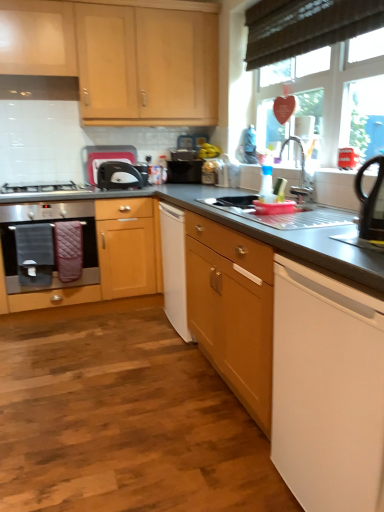
The height and width of the screenshot is (512, 384). Describe the element at coordinates (369, 210) in the screenshot. I see `black plastic kettle at right, marked as the second appliance in a top-to-bottom arrangement` at that location.

Consider the image. What is the approximate width of metallic stainless steel sink at center?

21.48 inches.

Where is `metallic stainless steel sink at center`? The image size is (384, 512). metallic stainless steel sink at center is located at coordinates (281, 214).

At what (x,y) coordinates should I click in order to perform the action: click on black plastic kettle at right, marked as the second appliance in a top-to-bottom arrangement. Please return your answer as a coordinate pair (x, y). Image resolution: width=384 pixels, height=512 pixels. Looking at the image, I should click on (369, 210).

Is matte wood cabinets at upper left, arranged as the second cabinetry when ordered from the bottom, wider or thinner than black matte microwave at center?

Considering their sizes, matte wood cabinets at upper left, arranged as the second cabinetry when ordered from the bottom, looks broader than black matte microwave at center.

From the image's perspective, is matte wood cabinets at upper left, arranged as the second cabinetry when ordered from the bottom, below black matte microwave at center?

No, from the image's perspective, matte wood cabinets at upper left, arranged as the second cabinetry when ordered from the bottom, is not below black matte microwave at center.

From a real-world perspective, is matte wood cabinets at upper left, the 1th cabinetry positioned from the top, beneath black matte microwave at center?

Actually, matte wood cabinets at upper left, the 1th cabinetry positioned from the top, is physically above black matte microwave at center in the real world.

Does matte wood cabinets at upper left, arranged as the second cabinetry when ordered from the bottom, turn towards black matte microwave at center?

No, matte wood cabinets at upper left, arranged as the second cabinetry when ordered from the bottom, is not aimed at black matte microwave at center.

Is metallic stainless steel sink at center in front of or behind metallic faucet at upper right in the image?

Visually, metallic stainless steel sink at center is located in front of metallic faucet at upper right.

Is metallic stainless steel sink at center located outside metallic faucet at upper right?

Indeed, metallic stainless steel sink at center is completely outside metallic faucet at upper right.

Which point is more forward, (233, 197) or (297, 201)?

The point (297, 201) is in front.

I want to click on tap behind the metallic stainless steel sink at center, so click(x=301, y=173).

From a real-world perspective, is white matte dishwasher at lower right, the 1th home appliance in the right-to-left sequence, physically located above or below white plastic toaster at upper center, placed as the first appliance when sorted from left to right?

Clearly, from a real-world perspective, white matte dishwasher at lower right, the 1th home appliance in the right-to-left sequence, is below white plastic toaster at upper center, placed as the first appliance when sorted from left to right.

In the scene shown: Is white matte dishwasher at lower right, the 1th home appliance when ordered from front to back, in front of or behind white plastic toaster at upper center, placed as the first appliance when sorted from left to right, in the image?

Clearly, white matte dishwasher at lower right, the 1th home appliance when ordered from front to back, is in front of white plastic toaster at upper center, placed as the first appliance when sorted from left to right.

In the scene shown: Is white matte dishwasher at lower right, the 1th home appliance in the right-to-left sequence, oriented towards white plastic toaster at upper center, acting as the second appliance starting from the bottom?

No, white matte dishwasher at lower right, the 1th home appliance in the right-to-left sequence, is not oriented towards white plastic toaster at upper center, acting as the second appliance starting from the bottom.

From the image's perspective, would you say white matte dishwasher at lower right, the 1th home appliance in the right-to-left sequence, is positioned over white plastic toaster at upper center, which is the 2th appliance from right to left?

No, from the image's perspective, white matte dishwasher at lower right, the 1th home appliance in the right-to-left sequence, is not over white plastic toaster at upper center, which is the 2th appliance from right to left.

Which is less distant, (x=280, y=150) or (x=91, y=180)?

Point (x=280, y=150) is positioned closer to the camera compared to point (x=91, y=180).

Who is smaller, metallic faucet at upper right or white plastic toaster at upper center, arranged as the first appliance when viewed from the back?

Smaller between the two is metallic faucet at upper right.

Who is shorter, metallic faucet at upper right or white plastic toaster at upper center, acting as the second appliance starting from the bottom?

white plastic toaster at upper center, acting as the second appliance starting from the bottom.

Between point (129, 156) and point (254, 211), which one is positioned in front?

Positioned in front is point (254, 211).

Who is shorter, white plastic toaster at upper center, acting as the second appliance starting from the bottom, or metallic stainless steel sink at center?

metallic stainless steel sink at center is shorter.

Is white plastic toaster at upper center, which is the 2th appliance from right to left, aimed at metallic stainless steel sink at center?

Yes, white plastic toaster at upper center, which is the 2th appliance from right to left, is oriented towards metallic stainless steel sink at center.

Is black plastic kettle at right, placed as the 1th appliance when sorted from right to left, at the left side of wooden floor at lower left?

In fact, black plastic kettle at right, placed as the 1th appliance when sorted from right to left, is to the right of wooden floor at lower left.

Is black plastic kettle at right, placed as the 1th appliance when sorted from right to left, behind wooden floor at lower left?

Yes, the depth of black plastic kettle at right, placed as the 1th appliance when sorted from right to left, is greater than that of wooden floor at lower left.

Is the surface of black plastic kettle at right, the second appliance in the back-to-front sequence, in direct contact with wooden floor at lower left?

No, black plastic kettle at right, the second appliance in the back-to-front sequence, is not next to wooden floor at lower left.

Can you confirm if black plastic kettle at right, which ranks as the 1th appliance in front-to-back order, is wider than wooden floor at lower left?

Incorrect, the width of black plastic kettle at right, which ranks as the 1th appliance in front-to-back order, does not surpass that of wooden floor at lower left.

Are wooden floor at lower left and metallic stainless steel sink at center located far from each other?

Yes, wooden floor at lower left is far from metallic stainless steel sink at center.

Does wooden floor at lower left have a larger size compared to metallic stainless steel sink at center?

Yes.

From a real-world perspective, who is located higher, wooden floor at lower left or metallic stainless steel sink at center?

In real-world perspective, metallic stainless steel sink at center is above.

I want to click on kitchen appliance below the matte wood cabinets at upper left, the 1th cabinetry positioned from the top (from the image's perspective), so [x=118, y=176].

At what (x,y) coordinates should I click in order to perform the action: click on sink below the metallic faucet at upper right (from a real-world perspective). Please return your answer as a coordinate pair (x, y). This screenshot has width=384, height=512. Looking at the image, I should click on coord(281,214).

Based on their spatial positions, is black matte microwave at center or wooden cabinet at left, the 2th cabinetry when ordered from top to bottom, closer to metallic faucet at upper right?

black matte microwave at center is positioned closer to the anchor metallic faucet at upper right.

When comparing their distances from black matte microwave at center, does satin silver gas stove at left or white matte dishwasher at lower right, the 2th home appliance from the left, seem further?

The object further to black matte microwave at center is white matte dishwasher at lower right, the 2th home appliance from the left.

Estimate the real-world distances between objects in this image. Which object is further from stainless steel oven at left, which is the 1th home appliance from back to front, metallic faucet at upper right or white matte dishwasher at lower right, arranged as the second home appliance when viewed from the back?

Among the two, white matte dishwasher at lower right, arranged as the second home appliance when viewed from the back, is located further to stainless steel oven at left, which is the 1th home appliance from back to front.

In the scene shown: Considering their positions, is wooden cabinet at left, the first cabinetry when ordered from bottom to top, positioned further to satin silver gas stove at left than black matte microwave at center?

Based on the image, wooden cabinet at left, the first cabinetry when ordered from bottom to top, appears to be further to satin silver gas stove at left.

Estimate the real-world distances between objects in this image. Which object is closer to stainless steel oven at left, which is the 1th home appliance from back to front, black plastic kettle at right, which appears as the first appliance when ordered from the bottom, or metallic faucet at upper right?

The object closer to stainless steel oven at left, which is the 1th home appliance from back to front, is metallic faucet at upper right.

Looking at the image, which one is located closer to metallic stainless steel sink at center, metallic faucet at upper right or black plastic kettle at right, the 2th appliance positioned from the left?

The object closer to metallic stainless steel sink at center is metallic faucet at upper right.

When comparing their distances from metallic faucet at upper right, does matte wood cabinets at upper left, arranged as the second cabinetry when ordered from the bottom, or metallic stainless steel sink at center seem closer?

metallic stainless steel sink at center is positioned closer to the anchor metallic faucet at upper right.

Looking at the image, which one is located closer to satin silver gas stove at left, stainless steel oven at left, the 1th home appliance when ordered from left to right, or black plastic kettle at right, which appears as the first appliance when ordered from the bottom?

stainless steel oven at left, the 1th home appliance when ordered from left to right, is positioned closer to the anchor satin silver gas stove at left.

Locate an element on the screen. gas stove between metallic stainless steel sink at center and black matte microwave at center along the z-axis is located at coordinates (43, 187).

You are a GUI agent. You are given a task and a screenshot of the screen. Output one action in this format:
    pyautogui.click(x=<x>, y=<y>)
    Task: Click on the appliance between stainless steel oven at left, which appears as the 2th home appliance when viewed from the right, and metallic faucet at upper right
    
    Given the screenshot: What is the action you would take?
    click(104, 158)

Locate an element on the screen. The height and width of the screenshot is (512, 384). kitchen appliance between white plastic toaster at upper center, which is the second appliance in front-to-back order, and metallic faucet at upper right is located at coordinates (118, 176).

This screenshot has width=384, height=512. Find the location of `tap between white matte dishwasher at lower right, the 1th home appliance in the right-to-left sequence, and wooden cabinet at left, the first cabinetry when ordered from bottom to top, from front to back`. tap between white matte dishwasher at lower right, the 1th home appliance in the right-to-left sequence, and wooden cabinet at left, the first cabinetry when ordered from bottom to top, from front to back is located at coordinates (301, 173).